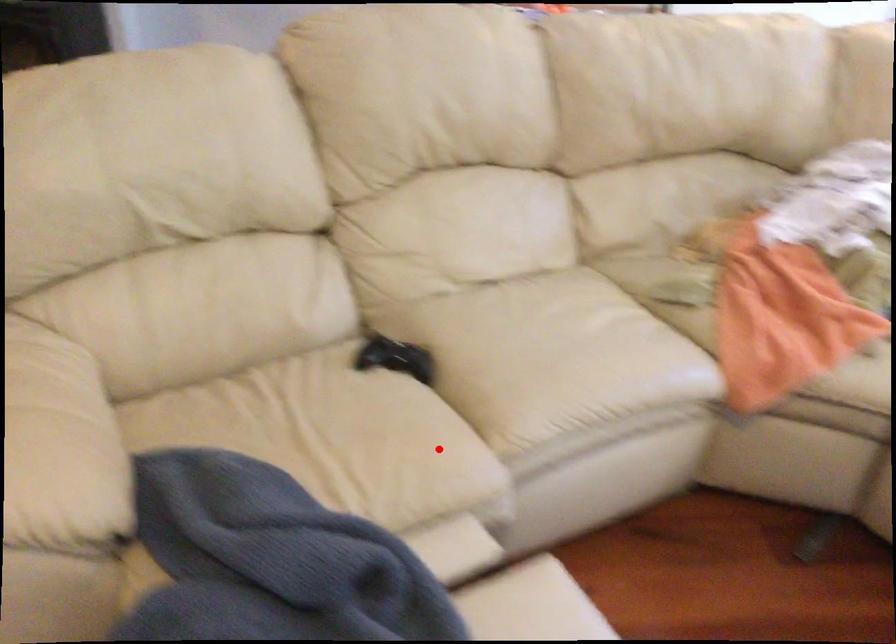
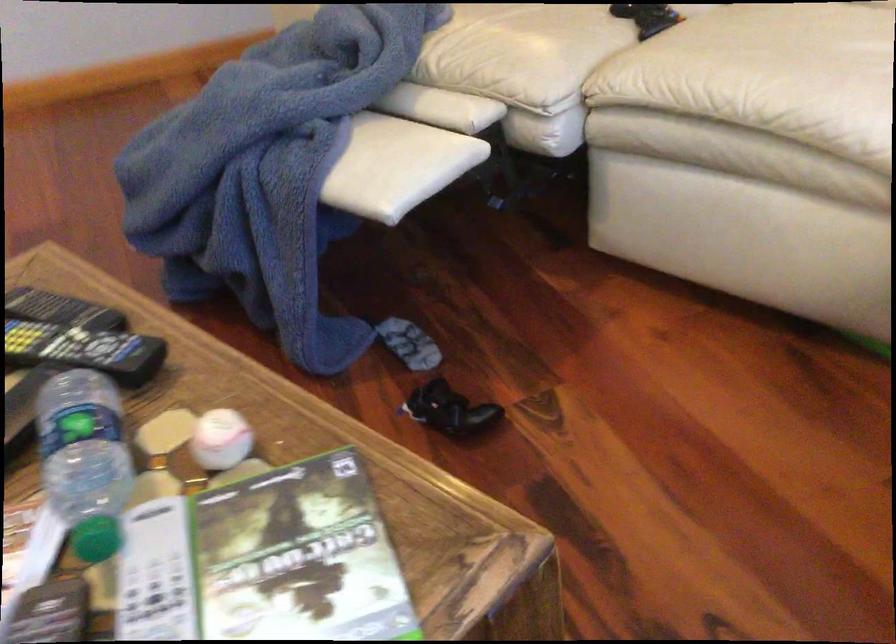
Locate, in the second image, the point that corresponds to the highlighted location in the first image.

(524, 51)